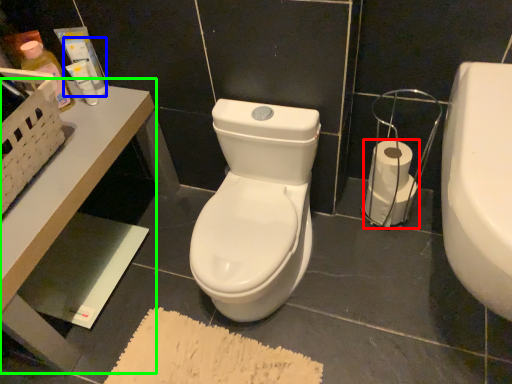
Question: Estimate the real-world distances between objects in this image. Which object is farther from toilet paper (highlighted by a red box), toiletry (highlighted by a blue box) or table (highlighted by a green box)?

Choices:
 (A) toiletry
 (B) table

Answer: (A)